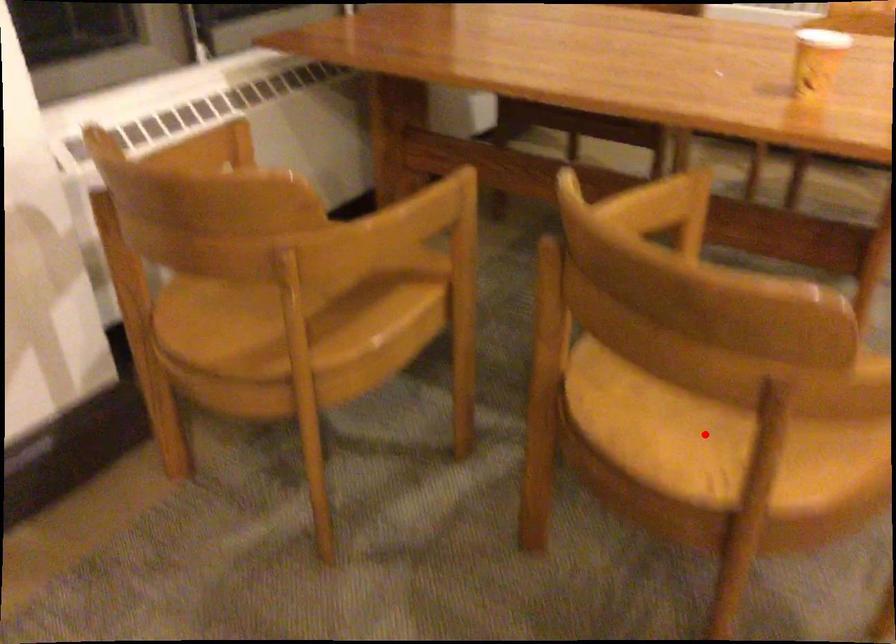
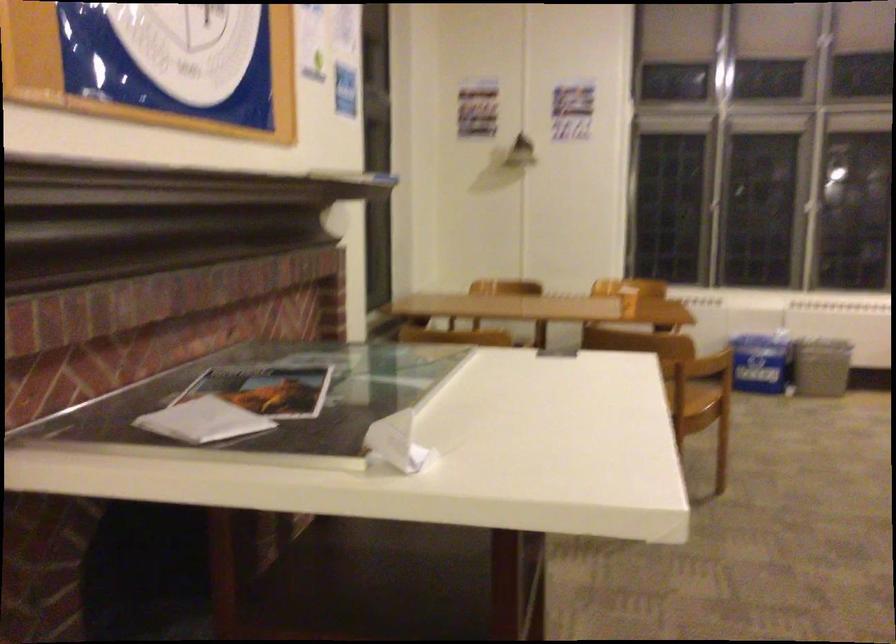
Question: I am providing you with two images of the same scene from different viewpoints. A red point is marked on the first image. At the location where the point appears in image 1, is it still visible in image 2?

Choices:
 (A) Yes
 (B) No

Answer: (B)